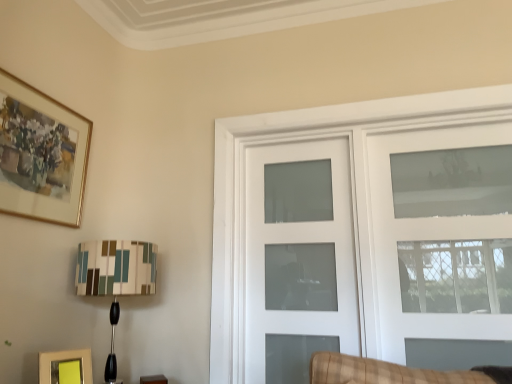
Question: From the image's perspective, is gold-framed painting at upper left, arranged as the first picture frame when viewed from the left, below matte yellow picture frame at lower left, acting as the 2th picture frame starting from the top?

Choices:
 (A) no
 (B) yes

Answer: (A)

Question: Does gold-framed painting at upper left, arranged as the first picture frame when viewed from the left, have a lesser width compared to matte yellow picture frame at lower left, acting as the 2th picture frame starting from the top?

Choices:
 (A) no
 (B) yes

Answer: (B)

Question: Is gold-framed painting at upper left, arranged as the first picture frame when viewed from the left, to the left of matte yellow picture frame at lower left, acting as the first picture frame starting from the right, from the viewer's perspective?

Choices:
 (A) no
 (B) yes

Answer: (B)

Question: From a real-world perspective, is gold-framed painting at upper left, the first picture frame viewed from the top, on matte yellow picture frame at lower left, acting as the 2th picture frame starting from the top?

Choices:
 (A) yes
 (B) no

Answer: (A)

Question: Could you tell me if gold-framed painting at upper left, arranged as the first picture frame when viewed from the left, is turned towards matte yellow picture frame at lower left, the second picture frame from the left?

Choices:
 (A) no
 (B) yes

Answer: (A)

Question: From a real-world perspective, relative to matte yellow picture frame at lower left, acting as the 2th picture frame starting from the top, is white frosted glass door at center, the second door in the right-to-left sequence, vertically above or below?

Choices:
 (A) below
 (B) above

Answer: (B)

Question: Considering the positions of white frosted glass door at center, the second door in the right-to-left sequence, and matte yellow picture frame at lower left, which ranks as the first picture frame in bottom-to-top order, in the image, is white frosted glass door at center, the second door in the right-to-left sequence, taller or shorter than matte yellow picture frame at lower left, which ranks as the first picture frame in bottom-to-top order,?

Choices:
 (A) tall
 (B) short

Answer: (A)

Question: Choose the correct answer: Is white frosted glass door at center, which is the first door from left to right, inside matte yellow picture frame at lower left, acting as the first picture frame starting from the right, or outside it?

Choices:
 (A) outside
 (B) inside

Answer: (A)

Question: Is white frosted glass door at center, the second door in the right-to-left sequence, to the left or to the right of matte yellow picture frame at lower left, the second picture frame from the left, in the image?

Choices:
 (A) right
 (B) left

Answer: (A)

Question: Considering the positions of point (269, 243) and point (114, 248), is point (269, 243) closer or farther from the camera than point (114, 248)?

Choices:
 (A) farther
 (B) closer

Answer: (A)

Question: Looking at their shapes, would you say white frosted glass door at center, which is the first door from left to right, is wider or thinner than multicolored fabric lampshade at lower left?

Choices:
 (A) wide
 (B) thin

Answer: (B)

Question: From a real-world perspective, is white frosted glass door at center, the second door in the right-to-left sequence, physically located above or below multicolored fabric lampshade at lower left?

Choices:
 (A) above
 (B) below

Answer: (A)

Question: Looking at the image, does white frosted glass door at center, which is the first door from left to right, seem bigger or smaller compared to multicolored fabric lampshade at lower left?

Choices:
 (A) small
 (B) big

Answer: (A)

Question: Based on their positions, is matte yellow picture frame at lower left, acting as the first picture frame starting from the right, located to the left or right of clear glass door at upper right, the 2th door from the left?

Choices:
 (A) right
 (B) left

Answer: (B)

Question: Choose the correct answer: Is matte yellow picture frame at lower left, the second picture frame from the left, inside clear glass door at upper right, the 2th door from the left, or outside it?

Choices:
 (A) outside
 (B) inside

Answer: (A)